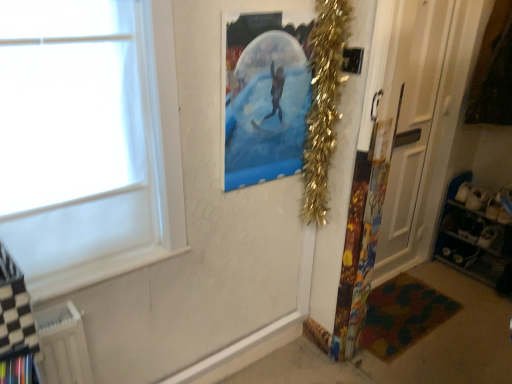
Question: In the image, is metallic blue shelves at lower right positioned in front of or behind transparent plastic poster at upper center?

Choices:
 (A) behind
 (B) front

Answer: (A)

Question: Would you say metallic blue shelves at lower right is to the left or to the right of transparent plastic poster at upper center in the picture?

Choices:
 (A) right
 (B) left

Answer: (A)

Question: Considering the real-world distances, which object is farthest from the gold tinsel garland at upper right?

Choices:
 (A) transparent plastic poster at upper center
 (B) multicolored fabric mat at lower right
 (C) white glossy door at right
 (D) metallic blue shelves at lower right
 (E) white plastic radiator at lower left

Answer: (D)

Question: Based on their relative distances, which object is farther from the metallic blue shelves at lower right?

Choices:
 (A) multicolored fabric mat at lower right
 (B) white plastic radiator at lower left
 (C) gold tinsel garland at upper right
 (D) transparent plastic poster at upper center
 (E) white glossy door at right

Answer: (B)